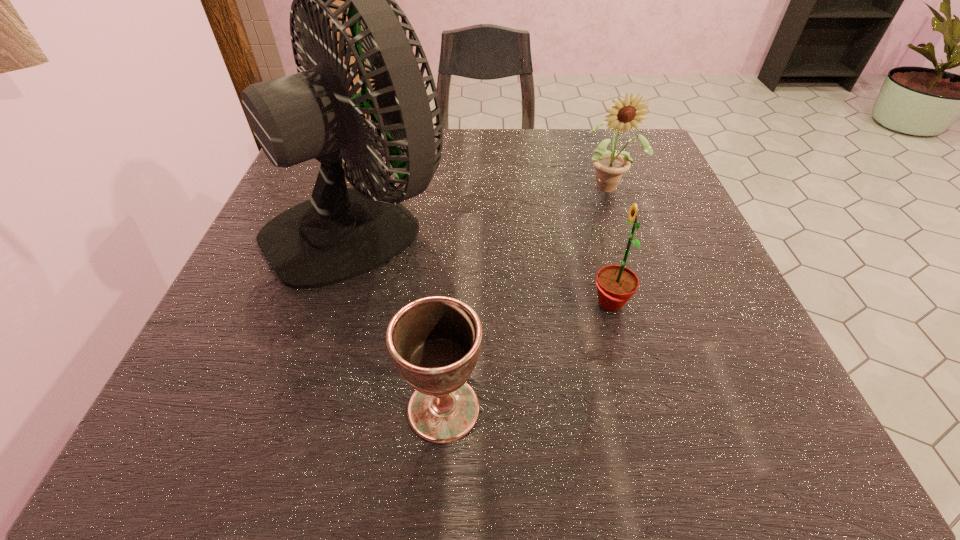
I want to click on the tallest object, so click(340, 233).

Where is `the farther sunflower`? This screenshot has width=960, height=540. the farther sunflower is located at coordinates (609, 166).

Find the location of a particular element. This screenshot has width=960, height=540. the nearer sunflower is located at coordinates (616, 284).

Where is `chalice`? chalice is located at coordinates (435, 341).

Locate an element on the screen. The width and height of the screenshot is (960, 540). the nearest object is located at coordinates (435, 341).

You are a GUI agent. You are given a task and a screenshot of the screen. Output one action in this format:
    pyautogui.click(x=<x>, y=<y>)
    Task: Click on the vacant space situated in front of the tallest object to direct airflow
    
    Given the screenshot: What is the action you would take?
    pyautogui.click(x=549, y=222)

Locate an element on the screen. free space located 0.070m on the front-facing side of the farther sunflower is located at coordinates (621, 221).

Find the location of a particular element. The width and height of the screenshot is (960, 540). vacant region located 0.330m on the face of the nearer sunflower is located at coordinates (388, 303).

Locate an element on the screen. free location located 0.180m on the face of the nearer sunflower is located at coordinates (480, 303).

This screenshot has width=960, height=540. Identify the location of free region located on the face of the nearer sunflower. (437, 303).